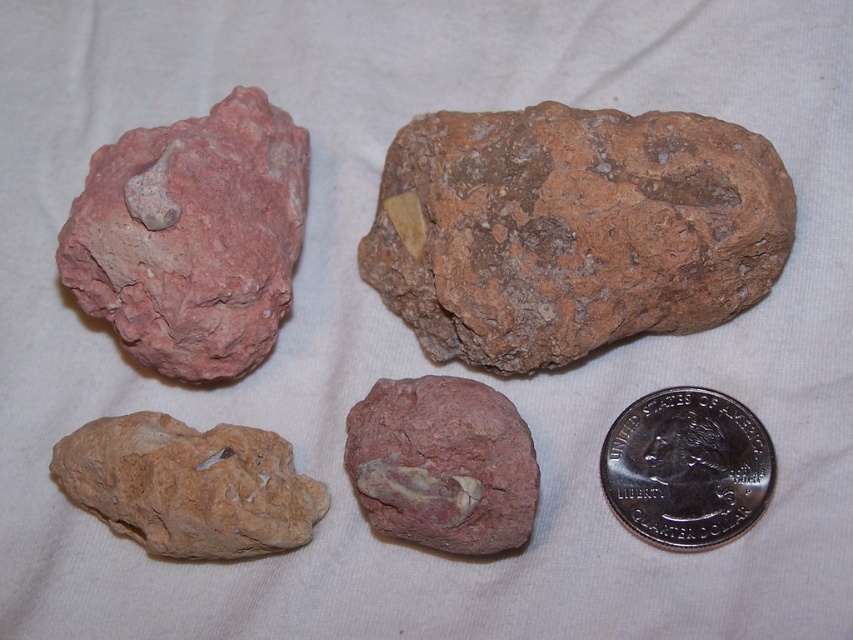
You are a geologist examining the image. You need to determine which rock is bigger between the pink rough rock at upper left and the matte stone rock at center. Which one is larger?

The pink rough rock at upper left is larger in size compared to the matte stone rock at center according to the description.